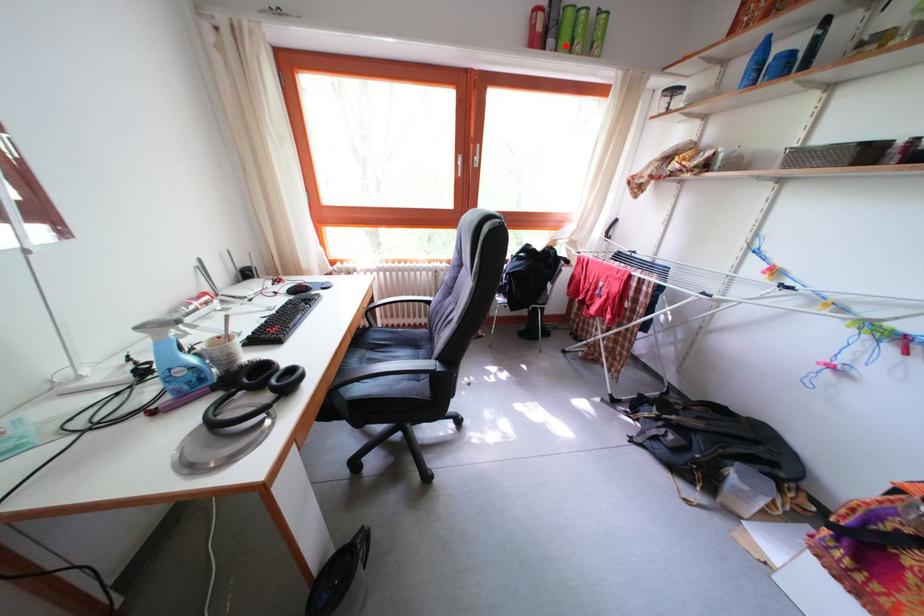
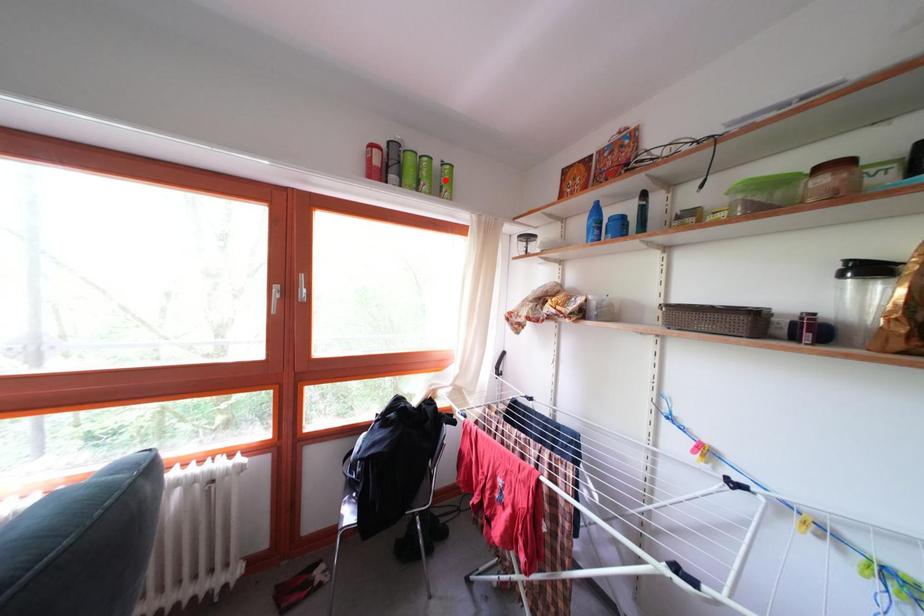
I am providing you with two images of the same scene from different viewpoints. A red point is marked on the first image and another point is marked on the second image. Do the highlighted points in image1 and image2 indicate the same real-world spot?

No